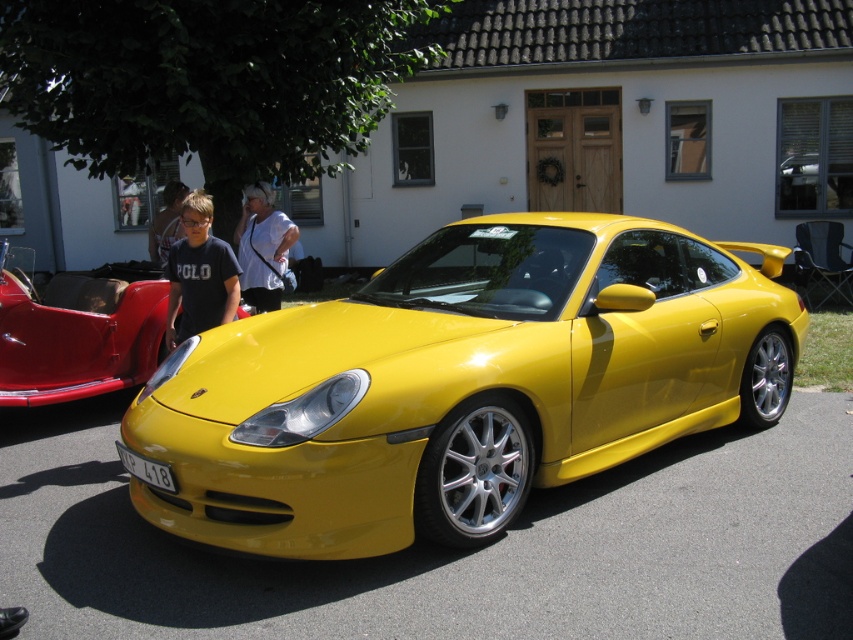
Is shiny yellow sports car at center above white fabric shirt at center?

Incorrect, shiny yellow sports car at center is not positioned above white fabric shirt at center.

Is point (42, 326) closer to camera compared to point (265, 301)?

That is True.

Find the location of `shiny yellow sports car at center`. shiny yellow sports car at center is located at coordinates (74, 333).

Is shiny yellow sports car at center positioned in front of light brown hair at center?

Yes, shiny yellow sports car at center is in front of light brown hair at center.

Which is above, shiny yellow sports car at center or light brown hair at center?

light brown hair at center is above.

What do you see at coordinates (74, 333) in the screenshot? This screenshot has width=853, height=640. I see `shiny yellow sports car at center` at bounding box center [74, 333].

Locate an element on the screen. This screenshot has height=640, width=853. shiny yellow sports car at center is located at coordinates (74, 333).

Can you confirm if shiny yellow sports car at center is taller than white plastic license plate at lower center?

Yes.

Who is positioned more to the left, shiny yellow sports car at center or white plastic license plate at lower center?

From the viewer's perspective, shiny yellow sports car at center appears more on the left side.

What do you see at coordinates (74, 333) in the screenshot? I see `shiny yellow sports car at center` at bounding box center [74, 333].

Locate an element on the screen. The height and width of the screenshot is (640, 853). shiny yellow sports car at center is located at coordinates (74, 333).